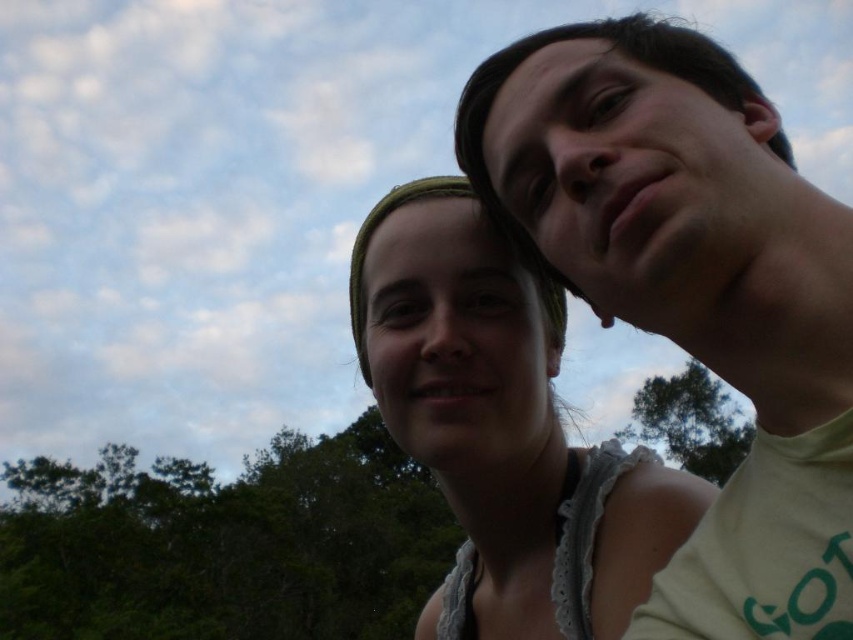
Image resolution: width=853 pixels, height=640 pixels. Describe the element at coordinates (693, 289) in the screenshot. I see `matte green t-shirt at upper right` at that location.

Which is more to the left, matte green t-shirt at upper right or green leafy tree at upper right?

matte green t-shirt at upper right is more to the left.

Which is behind, point (585, 88) or point (699, 435)?

Positioned behind is point (699, 435).

This screenshot has height=640, width=853. I want to click on matte green t-shirt at upper right, so click(x=693, y=289).

Which of these two, matte green t-shirt at upper right or matte white shirt at center, stands taller?

matte white shirt at center

Does matte green t-shirt at upper right appear under matte white shirt at center?

Incorrect, matte green t-shirt at upper right is not positioned below matte white shirt at center.

Is point (650, 140) in front of point (457, 202)?

Yes, point (650, 140) is in front of point (457, 202).

This screenshot has height=640, width=853. Identify the location of matte green t-shirt at upper right. (693, 289).

Which is more to the right, matte white shirt at center or green leafy tree at upper right?

From the viewer's perspective, green leafy tree at upper right appears more on the right side.

Can you confirm if matte white shirt at center is taller than green leafy tree at upper right?

Incorrect, matte white shirt at center's height is not larger of green leafy tree at upper right's.

Between point (532, 358) and point (669, 458), which one is positioned behind?

The point (669, 458) is more distant.

Where is `matte white shirt at center`? matte white shirt at center is located at coordinates (503, 428).